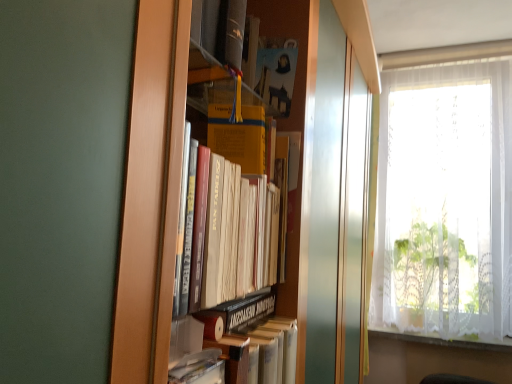
Question: Can you confirm if white lace curtain at lower right is wider than white lace curtain at right?

Choices:
 (A) no
 (B) yes

Answer: (A)

Question: Can you confirm if white lace curtain at lower right is shorter than white lace curtain at right?

Choices:
 (A) no
 (B) yes

Answer: (B)

Question: Does white lace curtain at lower right have a smaller size compared to white lace curtain at right?

Choices:
 (A) no
 (B) yes

Answer: (B)

Question: Is white lace curtain at lower right closer to the viewer compared to white lace curtain at right?

Choices:
 (A) yes
 (B) no

Answer: (B)

Question: Would you say white lace curtain at lower right is a long distance from white lace curtain at right?

Choices:
 (A) no
 (B) yes

Answer: (A)

Question: Is hardcover book at center to the left or to the right of white lace curtain at lower right in the image?

Choices:
 (A) left
 (B) right

Answer: (A)

Question: Based on their sizes in the image, would you say hardcover book at center is bigger or smaller than white lace curtain at lower right?

Choices:
 (A) big
 (B) small

Answer: (A)

Question: Is hardcover book at center wider or thinner than white lace curtain at lower right?

Choices:
 (A) thin
 (B) wide

Answer: (A)

Question: From the image's perspective, relative to white lace curtain at lower right, is hardcover book at center above or below?

Choices:
 (A) above
 (B) below

Answer: (A)

Question: Is white lace curtain at lower right to the left or to the right of white lace curtain at right in the image?

Choices:
 (A) left
 (B) right

Answer: (A)

Question: Considering the positions of point [x=391, y=331] and point [x=496, y=339], is point [x=391, y=331] closer or farther from the camera than point [x=496, y=339]?

Choices:
 (A) farther
 (B) closer

Answer: (A)

Question: In terms of width, does white lace curtain at lower right look wider or thinner when compared to white lace curtain at right?

Choices:
 (A) wide
 (B) thin

Answer: (B)

Question: From a real-world perspective, is white lace curtain at lower right positioned above or below white lace curtain at right?

Choices:
 (A) above
 (B) below

Answer: (B)

Question: Is white lace curtain at right taller or shorter than white lace curtain at lower right?

Choices:
 (A) tall
 (B) short

Answer: (A)

Question: In the image, is white lace curtain at right positioned in front of or behind white lace curtain at lower right?

Choices:
 (A) behind
 (B) front

Answer: (B)